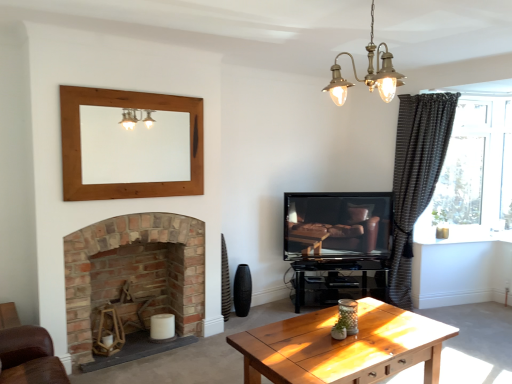
This screenshot has width=512, height=384. Describe the element at coordinates (116, 247) in the screenshot. I see `brick fireplace at lower left` at that location.

Identify the location of clear glass window at right. The height and width of the screenshot is (384, 512). (475, 168).

The width and height of the screenshot is (512, 384). I want to click on dark grey textured curtain at right, so click(x=415, y=177).

You are a GUI agent. You are given a task and a screenshot of the screen. Output one action in this format:
    pyautogui.click(x=<x>, y=<y>)
    Task: Click on the brick fireplace at lower left
    The image size is (512, 384).
    Given the screenshot: What is the action you would take?
    pyautogui.click(x=116, y=247)

Considering the relative sizes of matte black tv at center and clear glass window at right in the image provided, is matte black tv at center thinner than clear glass window at right?

No, matte black tv at center is not thinner than clear glass window at right.

Is matte black tv at center facing away from clear glass window at right?

No, matte black tv at center is not facing away from clear glass window at right.

At what (x,y) coordinates should I click in order to perform the action: click on window that appears on the right of matte black tv at center. Please return your answer as a coordinate pair (x, y). The height and width of the screenshot is (384, 512). Looking at the image, I should click on (475, 168).

From a real-world perspective, which is physically above, matte black tv at center or clear glass window at right?

clear glass window at right is physically above.

Considering their positions, is brass/textured chandelier at upper center located in front of or behind matte black tv at center?

Visually, brass/textured chandelier at upper center is located in front of matte black tv at center.

Would you say brass/textured chandelier at upper center is a long distance from matte black tv at center?

That's right, there is a large distance between brass/textured chandelier at upper center and matte black tv at center.

From the image's perspective, which object appears higher, brass/textured chandelier at upper center or matte black tv at center?

From the image's view, brass/textured chandelier at upper center is above.

Which is behind, point (344, 83) or point (159, 120)?

Point (159, 120)

The height and width of the screenshot is (384, 512). I want to click on light fixture on the right of wooden mirror at upper center, so click(367, 73).

From a real-world perspective, between brass/textured chandelier at upper center and wooden mirror at upper center, who is vertically lower?

wooden mirror at upper center.

Is point (354, 248) more distant than point (84, 143)?

Yes, point (354, 248) is farther from viewer.

Is matte black tv at center not close to wooden mirror at upper center?

matte black tv at center is positioned a significant distance from wooden mirror at upper center.

Is matte black tv at center not within wooden mirror at upper center?

Yes, matte black tv at center is outside of wooden mirror at upper center.

How distant is matte black tv at center from wooden mirror at upper center?

matte black tv at center and wooden mirror at upper center are 1.79 meters apart.

Which of these two, dark grey textured curtain at right or brass/textured chandelier at upper center, stands taller?

Standing taller between the two is dark grey textured curtain at right.

Does point (433, 125) lie in front of point (373, 11)?

No, (433, 125) is further to viewer.

Is dark grey textured curtain at right with brass/textured chandelier at upper center?

dark grey textured curtain at right is not next to brass/textured chandelier at upper center, and they're not touching.

What's the angular difference between dark grey textured curtain at right and brass/textured chandelier at upper center's facing directions?

There is a 13.1-degree angle between the facing directions of dark grey textured curtain at right and brass/textured chandelier at upper center.

Does point (337, 213) appear closer or farther from the camera than point (76, 343)?

Point (337, 213) is positioned farther from the camera compared to point (76, 343).

From a real-world perspective, relative to brick fireplace at lower left, is matte black tv at center vertically above or below?

matte black tv at center is above brick fireplace at lower left.

Are matte black tv at center and brick fireplace at lower left far apart?

Yes, matte black tv at center and brick fireplace at lower left are quite far apart.

I want to click on mirror below the brass/textured chandelier at upper center (from a real-world perspective), so click(133, 147).

Is wooden mirror at upper center directly adjacent to brass/textured chandelier at upper center?

wooden mirror at upper center and brass/textured chandelier at upper center are clearly separated.

Looking at this image, what's the angular difference between wooden mirror at upper center and brass/textured chandelier at upper center's facing directions?

There is a 0.0827-degree angle between the facing directions of wooden mirror at upper center and brass/textured chandelier at upper center.

Between wooden mirror at upper center and brass/textured chandelier at upper center, which one is positioned behind?

Positioned behind is wooden mirror at upper center.

Image resolution: width=512 pixels, height=384 pixels. In the image, there is a matte black tv at center. Find the location of `window above it (from the image's perspective)`. window above it (from the image's perspective) is located at coordinates (475, 168).

Image resolution: width=512 pixels, height=384 pixels. Identify the location of light fixture to the left of matte black tv at center. (367, 73).

Based on the photo, from the image, which object appears to be farther from brick fireplace at lower left, clear glass window at right or dark grey textured curtain at right?

The object further to brick fireplace at lower left is clear glass window at right.

In the scene shown: When comparing their distances from wooden mirror at upper center, does dark grey textured curtain at right or matte black tv at center seem further?

Among the two, dark grey textured curtain at right is located further to wooden mirror at upper center.

When comparing their distances from brass/textured chandelier at upper center, does matte black tv at center or clear glass window at right seem further?

clear glass window at right is positioned further to the anchor brass/textured chandelier at upper center.

Looking at the image, which one is located further to dark grey textured curtain at right, brass/textured chandelier at upper center or wooden mirror at upper center?

wooden mirror at upper center.

Looking at the image, which one is located further to clear glass window at right, wooden mirror at upper center or matte black tv at center?

wooden mirror at upper center is positioned further to the anchor clear glass window at right.

Estimate the real-world distances between objects in this image. Which object is closer to dark grey textured curtain at right, brass/textured chandelier at upper center or matte black tv at center?

matte black tv at center lies closer to dark grey textured curtain at right than the other object.

When comparing their distances from brick fireplace at lower left, does brass/textured chandelier at upper center or wooden mirror at upper center seem further?

brass/textured chandelier at upper center is positioned further to the anchor brick fireplace at lower left.

When comparing their distances from brass/textured chandelier at upper center, does clear glass window at right or wooden mirror at upper center seem closer?

wooden mirror at upper center is closer to brass/textured chandelier at upper center.

Locate an element on the screen. television between wooden mirror at upper center and dark grey textured curtain at right is located at coordinates (337, 224).

You are a GUI agent. You are given a task and a screenshot of the screen. Output one action in this format:
    pyautogui.click(x=<x>, y=<y>)
    Task: Click on the television between brick fireplace at lower left and dark grey textured curtain at right in the horizontal direction
    Image resolution: width=512 pixels, height=384 pixels.
    Given the screenshot: What is the action you would take?
    pyautogui.click(x=337, y=224)

Locate an element on the screen. The image size is (512, 384). light fixture between brick fireplace at lower left and clear glass window at right is located at coordinates (367, 73).

Identify the location of light fixture located between wooden mirror at upper center and dark grey textured curtain at right in the left-right direction. (367, 73).